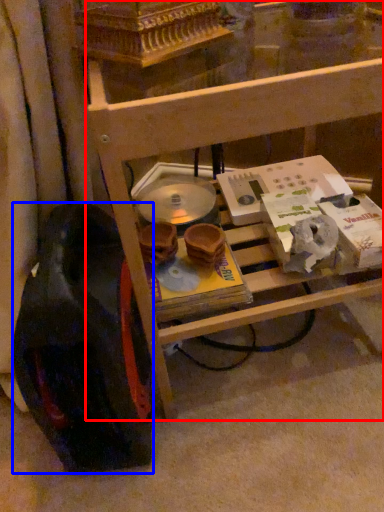
Question: Which point is closer to the camera, furniture (highlighted by a red box) or wheel (highlighted by a blue box)?

Choices:
 (A) furniture
 (B) wheel

Answer: (A)